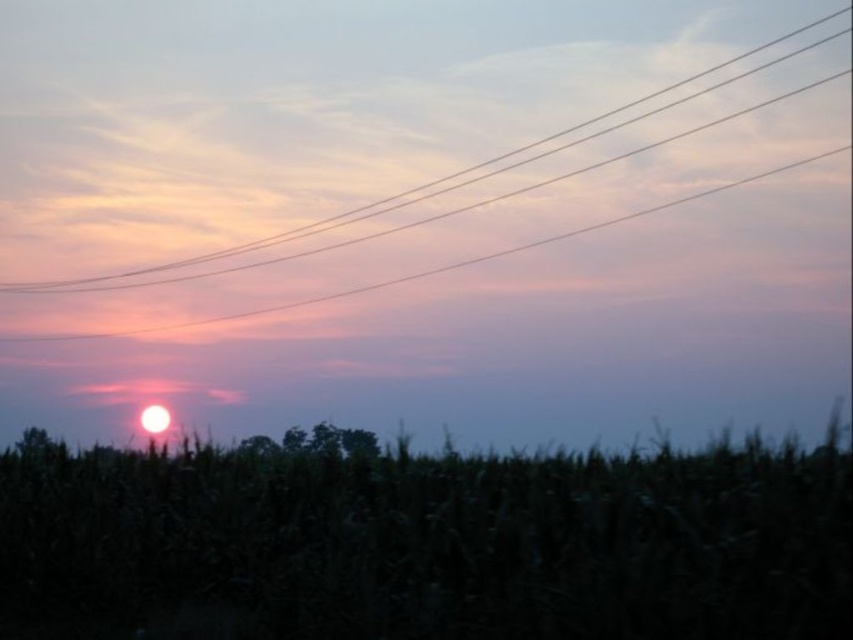
From the picture: Is green matte corn field at lower center bigger than clear wire at upper center?

Correct, green matte corn field at lower center is larger in size than clear wire at upper center.

What do you see at coordinates (422, 541) in the screenshot?
I see `green matte corn field at lower center` at bounding box center [422, 541].

This screenshot has height=640, width=853. I want to click on green matte corn field at lower center, so click(422, 541).